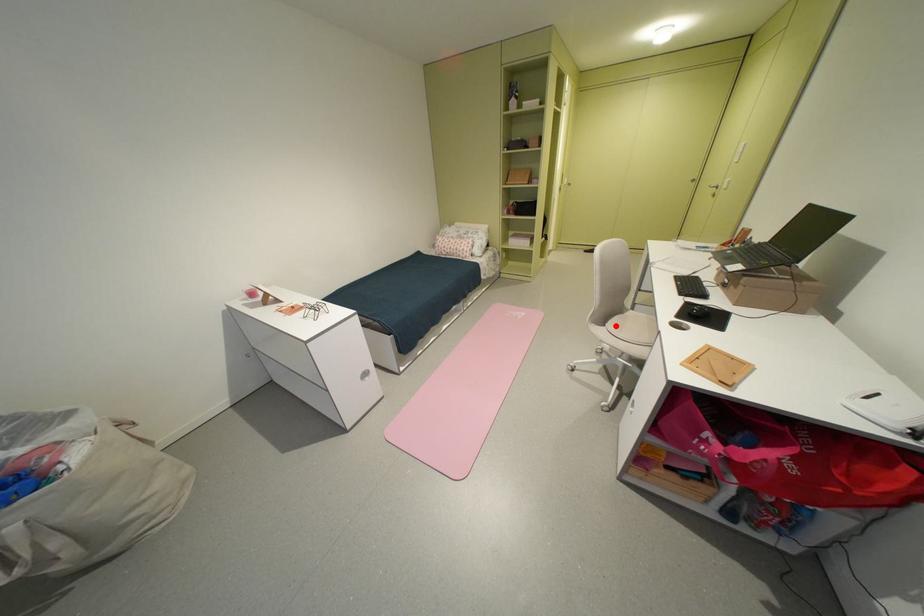
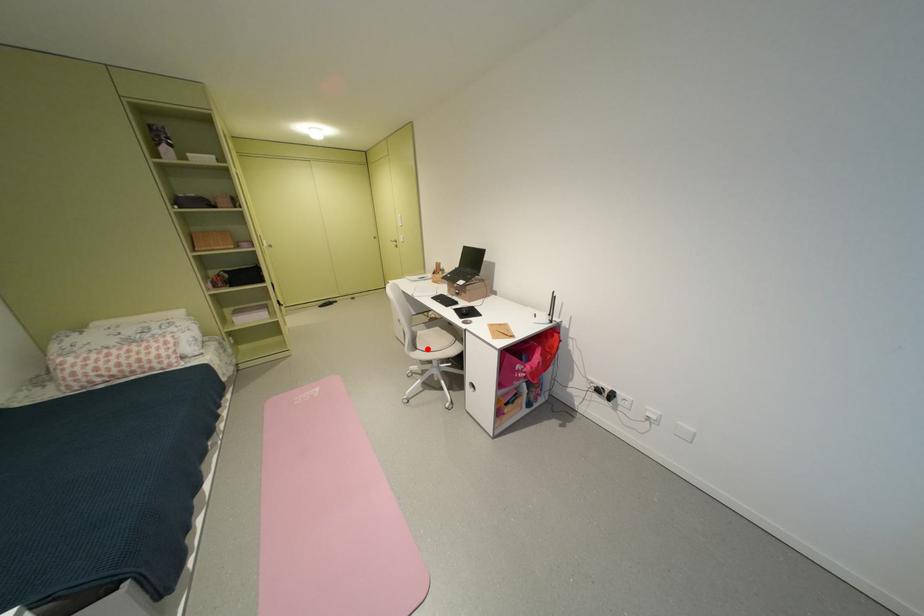
I am providing you with two images of the same scene from different viewpoints. A red point is marked on the first image and another point is marked on the second image. Is the red point in image1 aligned with the point shown in image2?

Yes